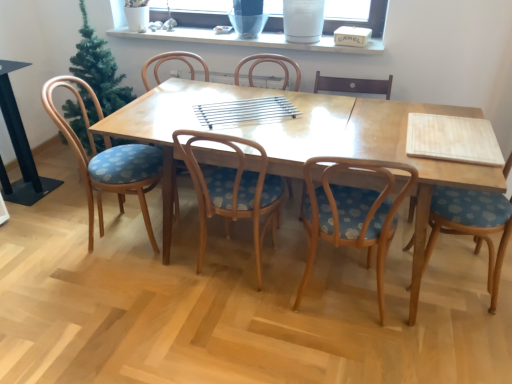
Locate an element on the screen. The height and width of the screenshot is (384, 512). free location in front of wooden chair with blue floral cushion at left, acting as the first chair starting from the left is located at coordinates (108, 285).